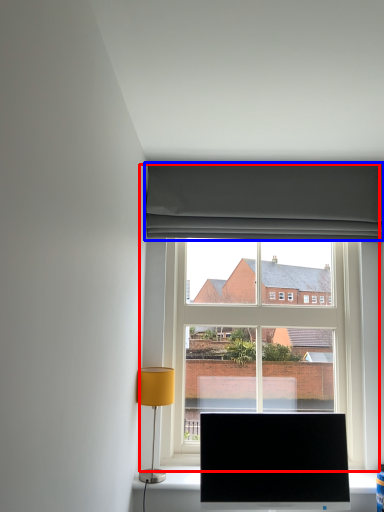
Question: Among these objects, which one is nearest to the camera, window (highlighted by a red box) or curtain (highlighted by a blue box)?

Choices:
 (A) window
 (B) curtain

Answer: (A)